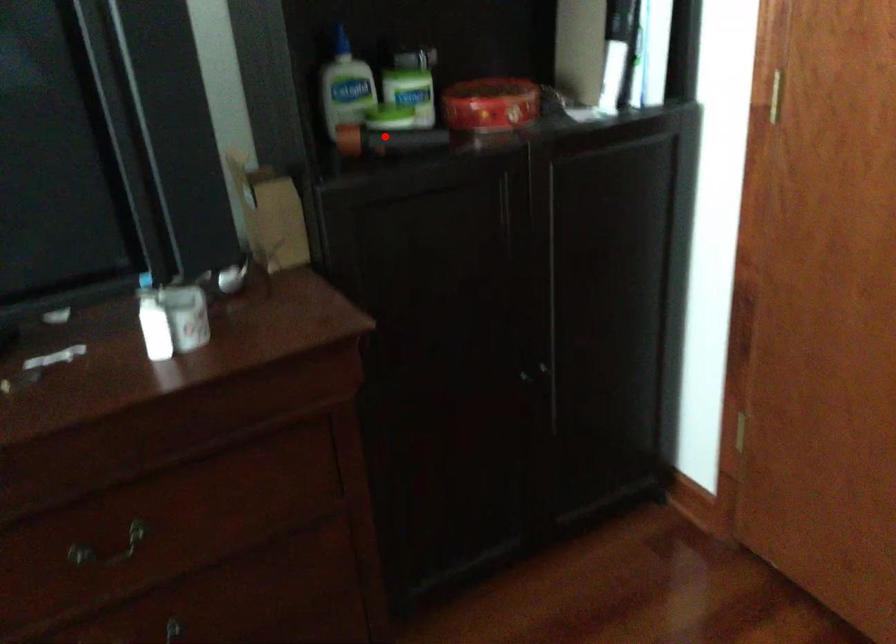
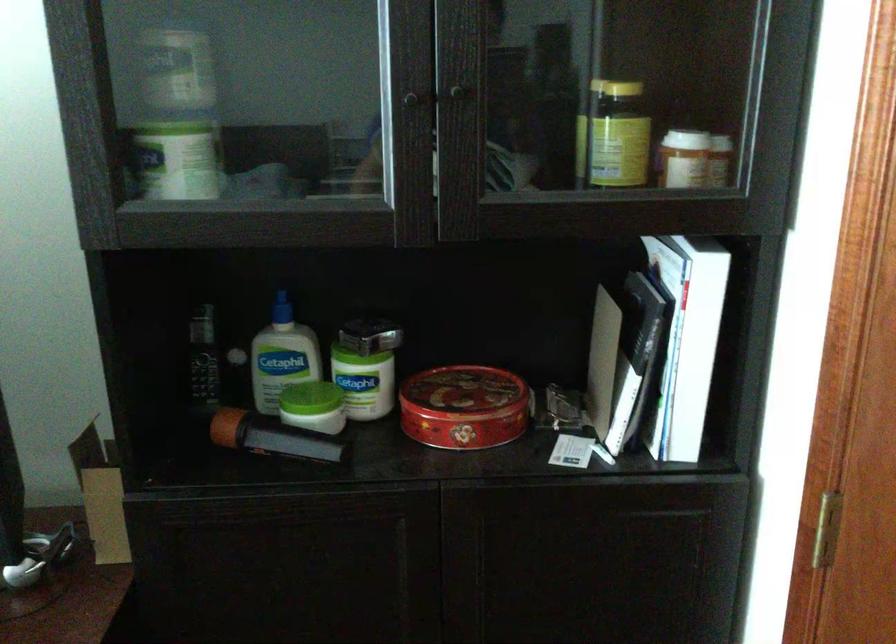
In the second image, find the point that corresponds to the highlighted location in the first image.

(268, 436)